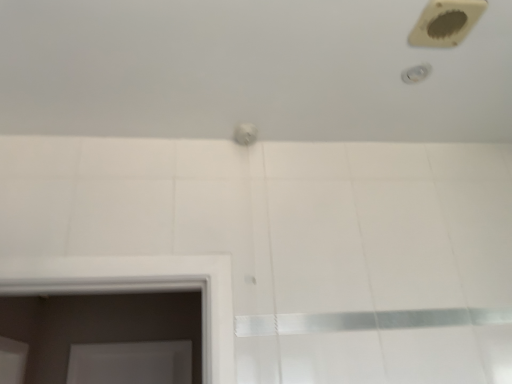
Question: From the image's perspective, is white glossy bath at upper center located above or below beige plastic hole at upper right?

Choices:
 (A) below
 (B) above

Answer: (A)

Question: Considering the positions of white glossy bath at upper center and beige plastic hole at upper right in the image, is white glossy bath at upper center bigger or smaller than beige plastic hole at upper right?

Choices:
 (A) small
 (B) big

Answer: (B)

Question: Which object is the closest to the beige plastic hole at upper right?

Choices:
 (A) white glossy bath at upper center
 (B) white glossy shower at upper right

Answer: (B)

Question: Which of these objects is positioned closest to the white glossy bath at upper center?

Choices:
 (A) beige plastic hole at upper right
 (B) white glossy shower at upper right

Answer: (A)